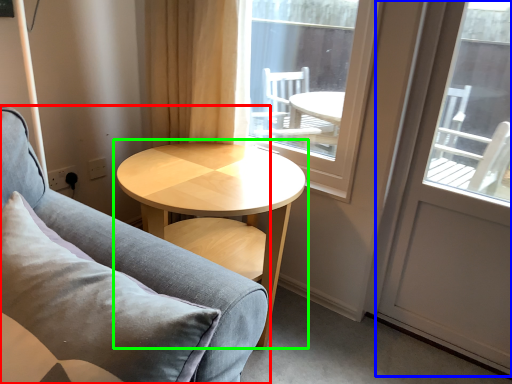
Question: Which object is positioned farthest from studio couch (highlighted by a red box)? Select from screen door (highlighted by a blue box) and coffee table (highlighted by a green box).

Choices:
 (A) screen door
 (B) coffee table

Answer: (A)